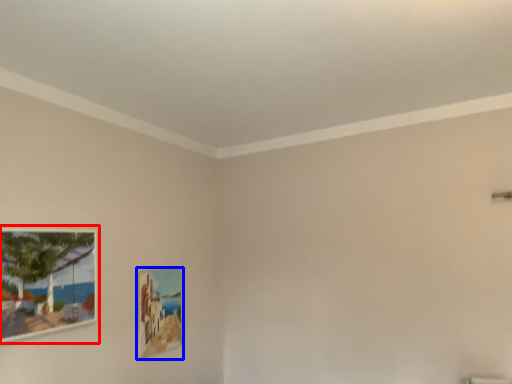
Question: Which of the following is the farthest to the observer, picture frame (highlighted by a red box) or picture frame (highlighted by a blue box)?

Choices:
 (A) picture frame
 (B) picture frame

Answer: (B)